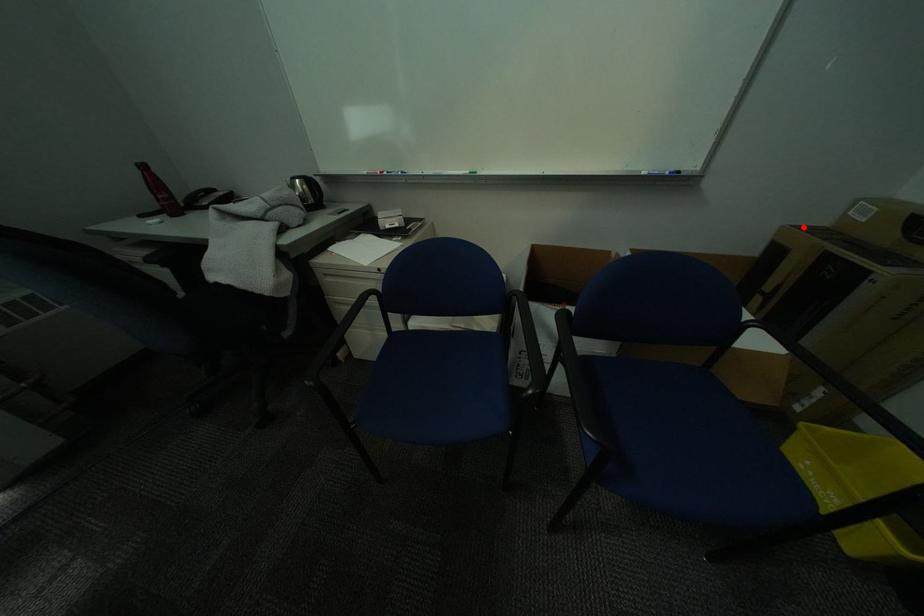
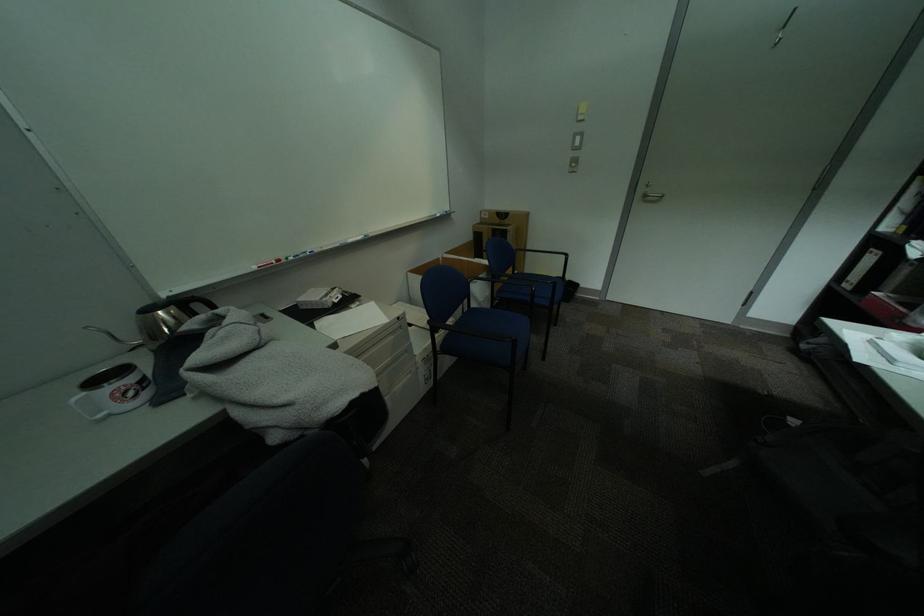
Question: I am providing you with two images of the same scene from different viewpoints. In image1, a red point is highlighted. Considering the same 3D point in image2, which of the following is correct?

Choices:
 (A) It is closer
 (B) It is farther

Answer: (A)